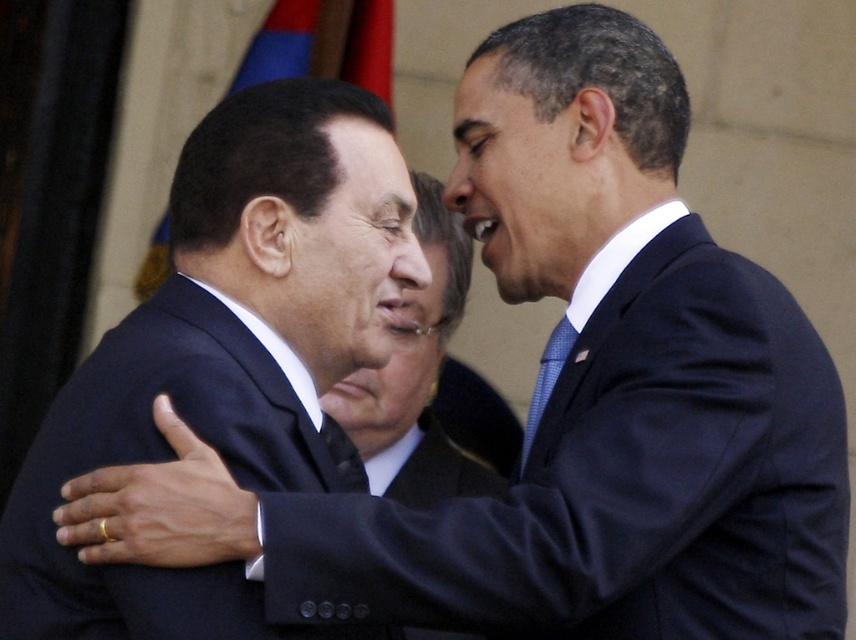
You are a photographer positioned at the back of the scene. You want to take a photo focusing on the blue textured tie at right. However, the dark blue suit at left is blocking your view. Can you adjust your position to capture the tie without the suit obstructing it?

The dark blue suit at left is closer to the viewer than the blue textured tie at right. By moving your position slightly to the side, you can angle your camera around the dark blue suit at left to capture the blue textured tie at right without obstruction.

You are a photographer who needs to adjust the lighting to ensure both the dark blue suit at left and the blue textured tie at right are well lit. Based on their positions, which object should you focus the light on first to ensure proper exposure?

The dark blue suit at left is located below the blue textured tie at right. Since the blue textured tie at right is higher up, it might be in a different lighting zone. Focus the light on the blue textured tie at right first to ensure both areas are properly exposed.

You are a photographer trying to capture a closeup of the blue textured tie at right without including the matte black suit at center in the frame. Given their relative sizes, is this possible?

The matte black suit at center is wider than the blue textured tie at right, so it might be challenging to frame the blue textured tie at right without including the matte black suit at center due to its larger size.